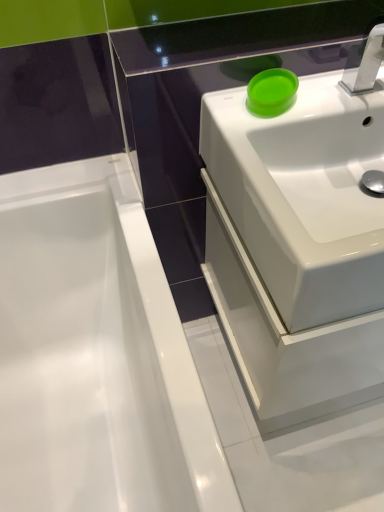
The height and width of the screenshot is (512, 384). What do you see at coordinates (271, 92) in the screenshot?
I see `matte green bowl at upper right` at bounding box center [271, 92].

Locate an element on the screen. The height and width of the screenshot is (512, 384). white glossy bathtub at left is located at coordinates (96, 354).

From the image's perspective, is white glossy bathtub at left located beneath matte green bowl at upper right?

Indeed, from the image's perspective, white glossy bathtub at left is shown beneath matte green bowl at upper right.

Between white glossy bathtub at left and matte green bowl at upper right, which one appears on the right side from the viewer's perspective?

Positioned to the right is matte green bowl at upper right.

Can you confirm if white glossy bathtub at left is thinner than matte green bowl at upper right?

In fact, white glossy bathtub at left might be wider than matte green bowl at upper right.

Is white glossy bathtub at left turned away from white glossy sink at upper right?

white glossy bathtub at left is not turned away from white glossy sink at upper right.

In terms of width, does white glossy bathtub at left look wider or thinner when compared to white glossy sink at upper right?

Clearly, white glossy bathtub at left has more width compared to white glossy sink at upper right.

The height and width of the screenshot is (512, 384). I want to click on bathtub lying below the white glossy sink at upper right (from the image's perspective), so [96, 354].

From the image's perspective, is white glossy bathtub at left under white glossy sink at upper right?

Yes, from the image's perspective, white glossy bathtub at left is beneath white glossy sink at upper right.

Between matte green bowl at upper right and white glossy bathtub at left, which one has larger width?

white glossy bathtub at left.

Where is `teal that is above the white glossy bathtub at left (from the image's perspective)`? teal that is above the white glossy bathtub at left (from the image's perspective) is located at coordinates (271, 92).

Between matte green bowl at upper right and white glossy bathtub at left, which one appears on the left side from the viewer's perspective?

white glossy bathtub at left is more to the left.

Which is in front, matte green bowl at upper right or white glossy bathtub at left?

Positioned in front is white glossy bathtub at left.

From a real-world perspective, is white glossy sink at upper right beneath matte green bowl at upper right?

Indeed, from a real-world perspective, white glossy sink at upper right is positioned beneath matte green bowl at upper right.

Is white glossy sink at upper right facing away from matte green bowl at upper right?

white glossy sink at upper right does not have its back to matte green bowl at upper right.

Which is in front, white glossy sink at upper right or matte green bowl at upper right?

white glossy sink at upper right is closer to the camera.

From the image's perspective, is white glossy sink at upper right under matte green bowl at upper right?

Yes, from the image's perspective, white glossy sink at upper right is beneath matte green bowl at upper right.

Considering the sizes of white glossy bathtub at left and silver metallic tap at upper right in the image, is white glossy bathtub at left wider or thinner than silver metallic tap at upper right?

Considering their sizes, white glossy bathtub at left looks broader than silver metallic tap at upper right.

Considering their positions, is white glossy bathtub at left located in front of or behind silver metallic tap at upper right?

In the image, white glossy bathtub at left appears in front of silver metallic tap at upper right.

Could you tell me if white glossy bathtub at left is facing silver metallic tap at upper right?

No, white glossy bathtub at left is not turned towards silver metallic tap at upper right.

Which object is closer to the camera taking this photo, silver metallic tap at upper right or white glossy bathtub at left?

white glossy bathtub at left is closer to the camera.

Between point (342, 77) and point (117, 242), which one is positioned in front?

The point (342, 77) is in front.

Find the location of `tap on the right of white glossy bathtub at left`. tap on the right of white glossy bathtub at left is located at coordinates (364, 61).

From a real-world perspective, which object rests below the other?

white glossy bathtub at left is physically lower.

How different are the orientations of white glossy sink at upper right and white glossy bathtub at left in degrees?

The facing directions of white glossy sink at upper right and white glossy bathtub at left are 90 degrees apart.

Which object is positioned more to the right, white glossy sink at upper right or white glossy bathtub at left?

Positioned to the right is white glossy sink at upper right.

This screenshot has height=512, width=384. Find the location of `bathtub that is in front of the white glossy sink at upper right`. bathtub that is in front of the white glossy sink at upper right is located at coordinates tap(96, 354).

Which is nearer, (235, 118) or (29, 433)?

The point (235, 118) is closer to the camera.

The height and width of the screenshot is (512, 384). Identify the location of teal that appears on the right of white glossy bathtub at left. (271, 92).

The height and width of the screenshot is (512, 384). I want to click on sink above the white glossy bathtub at left (from the image's perspective), so click(305, 192).

Estimate the real-world distances between objects in this image. Which object is closer to silver metallic tap at upper right, matte green bowl at upper right or white glossy sink at upper right?

The object closer to silver metallic tap at upper right is matte green bowl at upper right.

Estimate the real-world distances between objects in this image. Which object is closer to silver metallic tap at upper right, white glossy sink at upper right or matte green bowl at upper right?

Among the two, matte green bowl at upper right is located nearer to silver metallic tap at upper right.

From the image, which object appears to be nearer to white glossy sink at upper right, white glossy bathtub at left or matte green bowl at upper right?

Based on the image, matte green bowl at upper right appears to be nearer to white glossy sink at upper right.

Considering their positions, is white glossy sink at upper right positioned further to white glossy bathtub at left than silver metallic tap at upper right?

Among the two, silver metallic tap at upper right is located further to white glossy bathtub at left.

Which object lies nearer to the anchor point white glossy bathtub at left, silver metallic tap at upper right or white glossy sink at upper right?

white glossy sink at upper right.

Based on their spatial positions, is white glossy sink at upper right or white glossy bathtub at left closer to silver metallic tap at upper right?

Among the two, white glossy sink at upper right is located nearer to silver metallic tap at upper right.

Considering their positions, is matte green bowl at upper right positioned closer to white glossy bathtub at left than silver metallic tap at upper right?

The object closer to white glossy bathtub at left is matte green bowl at upper right.

From the image, which object appears to be nearer to white glossy sink at upper right, white glossy bathtub at left or silver metallic tap at upper right?

silver metallic tap at upper right is closer to white glossy sink at upper right.

Locate an element on the screen. sink between matte green bowl at upper right and silver metallic tap at upper right from left to right is located at coordinates (305, 192).

Where is `sink between white glossy bathtub at left and silver metallic tap at upper right in the horizontal direction`? sink between white glossy bathtub at left and silver metallic tap at upper right in the horizontal direction is located at coordinates (305, 192).

I want to click on sink between matte green bowl at upper right and white glossy bathtub at left in the up-down direction, so click(x=305, y=192).

You are a GUI agent. You are given a task and a screenshot of the screen. Output one action in this format:
    pyautogui.click(x=<x>, y=<y>)
    Task: Click on the teal between silver metallic tap at upper right and white glossy bathtub at left from top to bottom
    This screenshot has width=384, height=512.
    Given the screenshot: What is the action you would take?
    pyautogui.click(x=271, y=92)